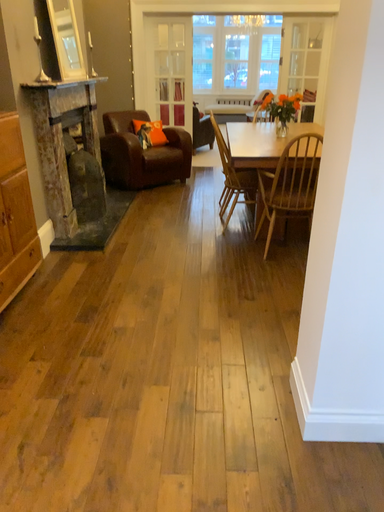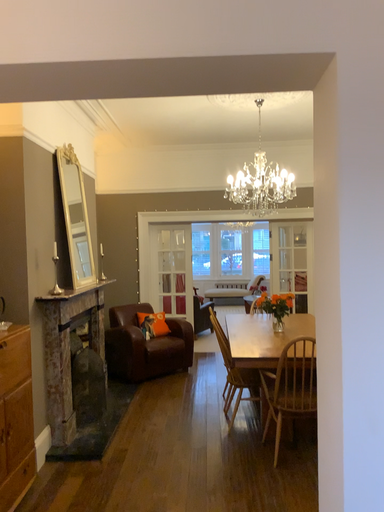
Question: How did the camera likely rotate when shooting the video?

Choices:
 (A) rotated downward
 (B) rotated upward

Answer: (B)